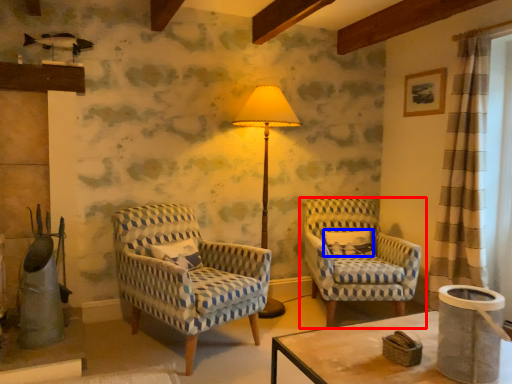
Question: Among these objects, which one is farthest to the camera, chair (highlighted by a red box) or pillow (highlighted by a blue box)?

Choices:
 (A) chair
 (B) pillow

Answer: (B)